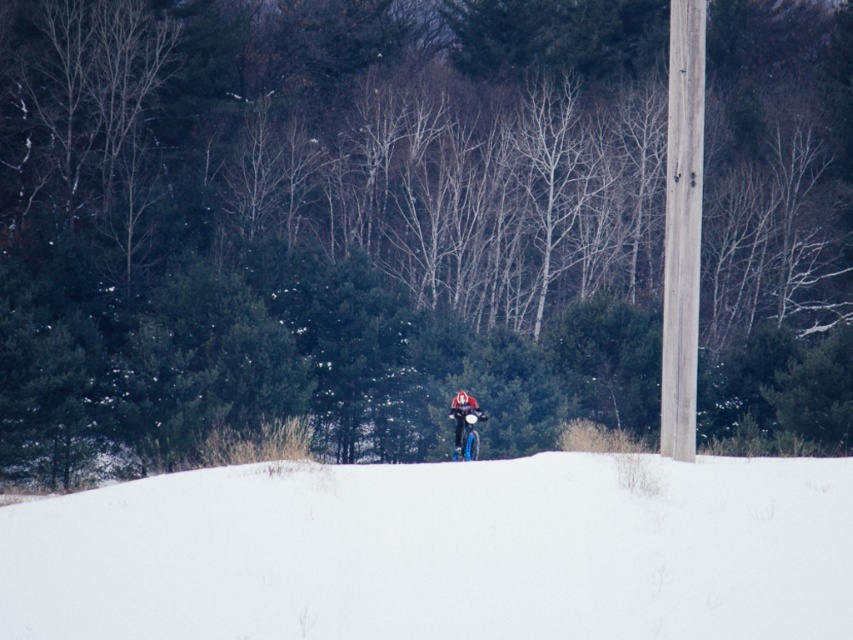
Who is shorter, white snow at center or shiny blue snowboard at center?

With less height is white snow at center.

Can you confirm if white snow at center is thinner than shiny blue snowboard at center?

No, white snow at center is not thinner than shiny blue snowboard at center.

What do you see at coordinates (440, 552) in the screenshot? The width and height of the screenshot is (853, 640). I see `white snow at center` at bounding box center [440, 552].

Find the location of a particular element. The image size is (853, 640). white snow at center is located at coordinates coord(440,552).

Between concrete pole at right and shiny blue snowboard at center, which one appears on the left side from the viewer's perspective?

shiny blue snowboard at center

Does point (672, 97) come in front of point (474, 406)?

Yes, it is in front of point (474, 406).

Locate an element on the screen. This screenshot has width=853, height=640. concrete pole at right is located at coordinates (682, 227).

Based on the photo, does white snow at center have a lesser width compared to concrete pole at right?

No, white snow at center is not thinner than concrete pole at right.

Does white snow at center have a smaller size compared to concrete pole at right?

Yes.

You are a GUI agent. You are given a task and a screenshot of the screen. Output one action in this format:
    pyautogui.click(x=<x>, y=<y>)
    Task: Click on the white snow at center
    
    Given the screenshot: What is the action you would take?
    pyautogui.click(x=440, y=552)